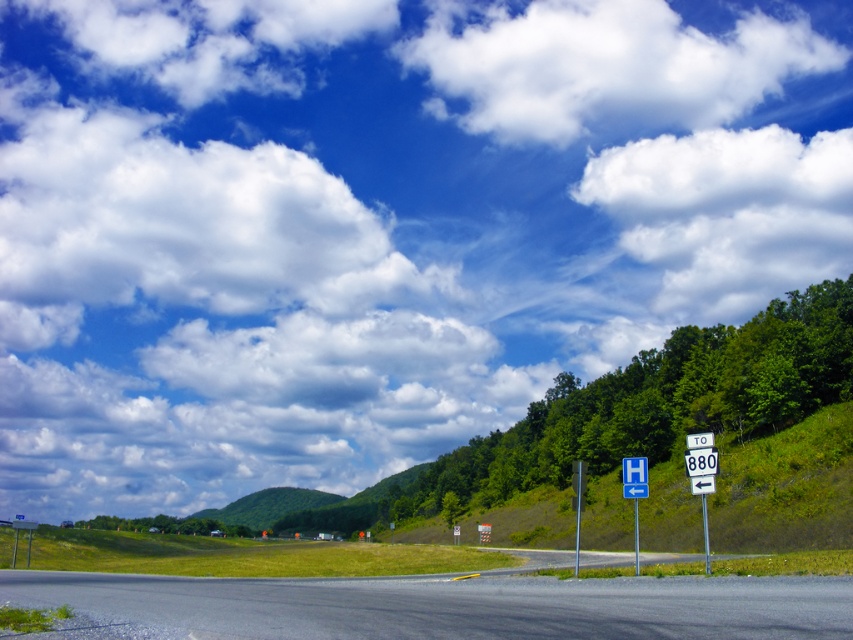
You are driving along the asphalt road at lower center and see the blue plastic sign at upper center. Which one appears larger in the image?

The asphalt road at lower center appears larger than the blue plastic sign at upper center.

You are driving a car with a 2.5 meter long trailer attached. You need to navigate through the narrow space between the blue plastic sign at upper center and the white plastic sign at center right. Can your vehicle and trailer pass through this space without touching the signs?

The distance between the blue plastic sign at upper center and the white plastic sign at center right is 2.64 meters. Since your vehicle with the trailer is 2.5 meters long, it can pass through the space as the distance is slightly longer than the trailer.

You are driving along the road and see the blue plastic sign at upper center and the white plastic sign at center right. Which sign is taller?

The blue plastic sign at upper center is much taller than the white plastic sign at center right.